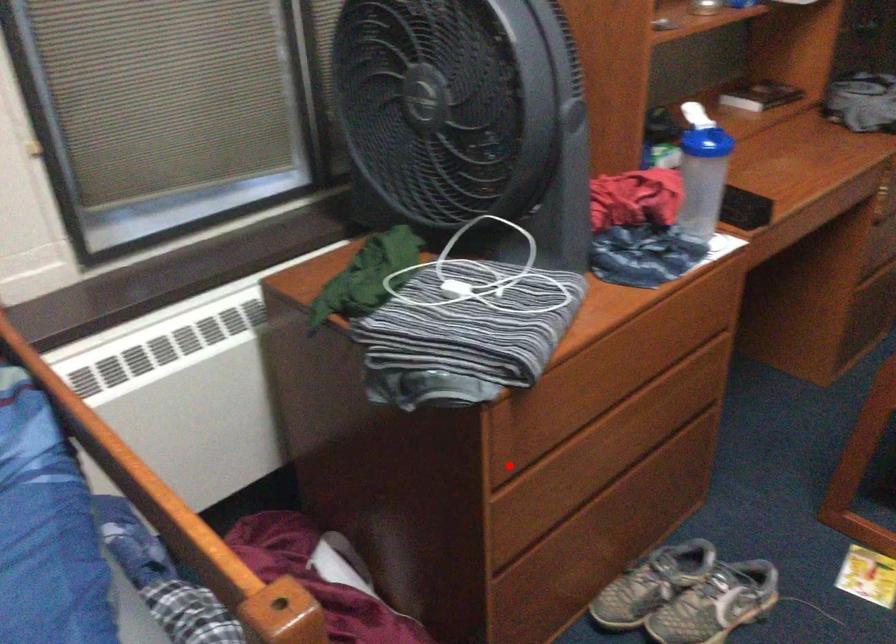
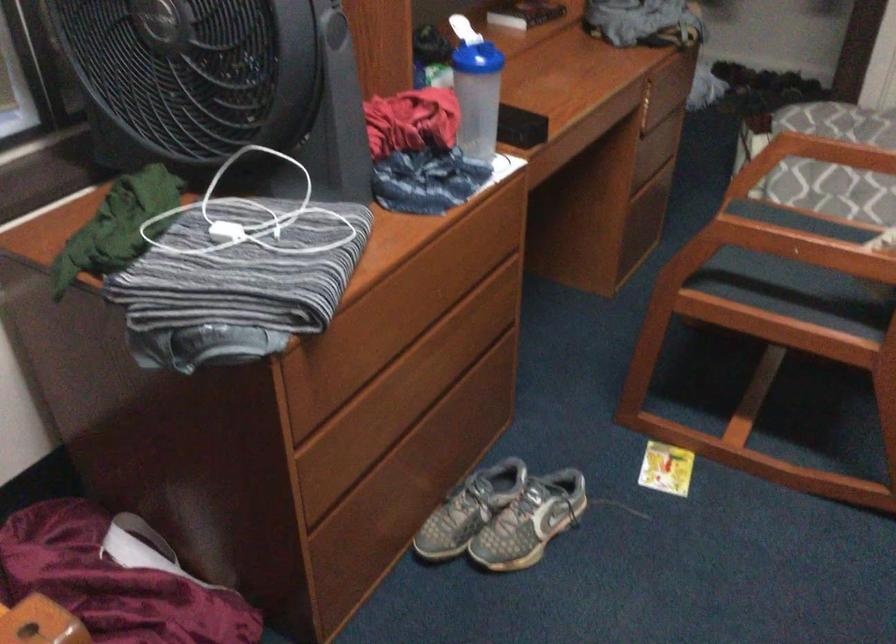
Find the pixel in the second image that matches the highlighted location in the first image.

(312, 415)